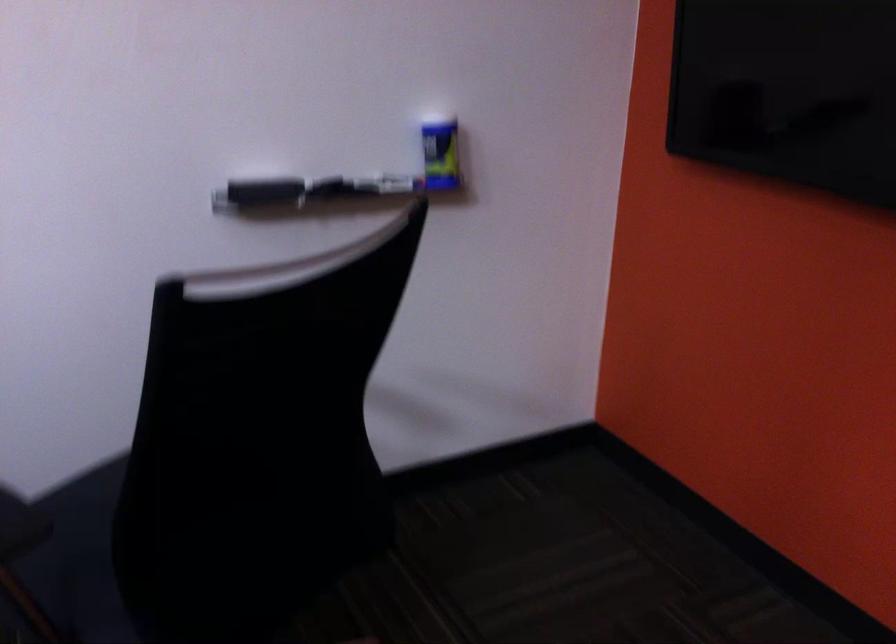
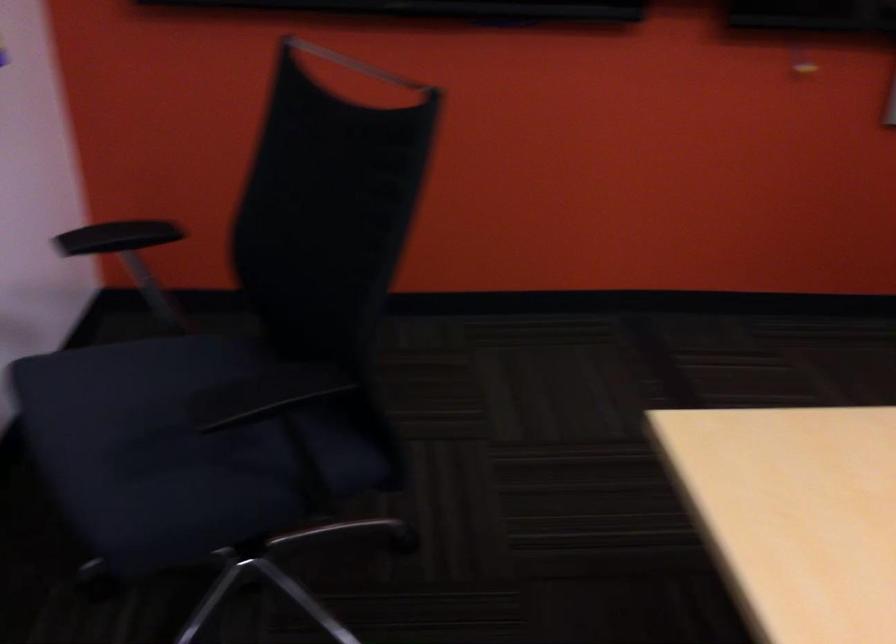
In the second image, find the point that corresponds to (93,520) in the first image.

(167, 442)